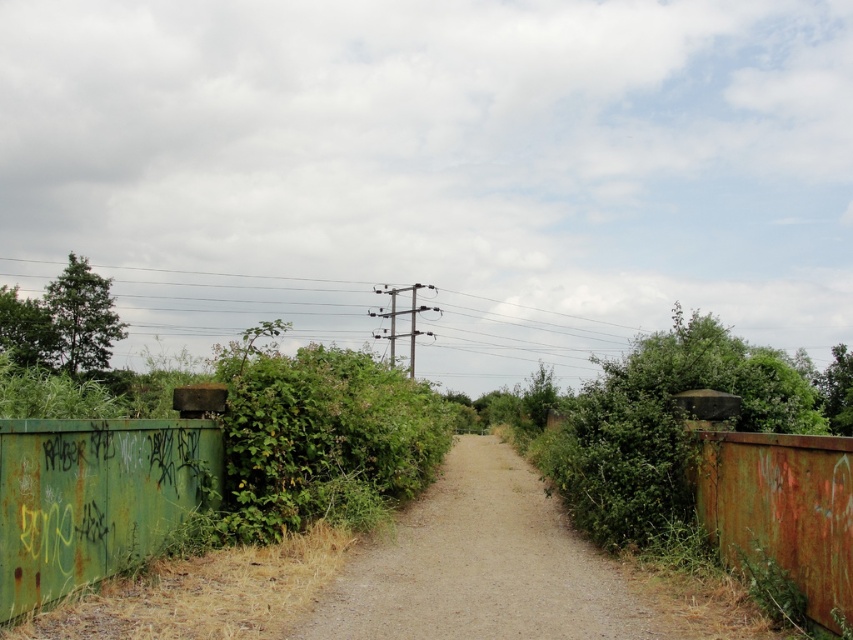
Is brown gravel path at center positioned behind rusty green metal fence at lower left?

Yes, brown gravel path at center is further from the viewer.

Is brown gravel path at center shorter than rusty green metal fence at lower left?

Indeed, brown gravel path at center has a lesser height compared to rusty green metal fence at lower left.

Does point (416, 548) lie in front of point (56, 513)?

No, it is not.

I want to click on brown gravel path at center, so click(x=480, y=564).

Is rusty green metal fence at lower left taller than rusty metal fence at right?

In fact, rusty green metal fence at lower left may be shorter than rusty metal fence at right.

Which is above, rusty green metal fence at lower left or rusty metal fence at right?

rusty green metal fence at lower left

Is point (41, 564) closer to camera compared to point (798, 490)?

Yes, point (41, 564) is closer to viewer.

At what (x,y) coordinates should I click in order to perform the action: click on rusty green metal fence at lower left. Please return your answer as a coordinate pair (x, y). This screenshot has height=640, width=853. Looking at the image, I should click on (93, 497).

Does brown gravel path at center have a greater height compared to rusty metal fence at right?

In fact, brown gravel path at center may be shorter than rusty metal fence at right.

Can you confirm if brown gravel path at center is positioned to the left of rusty metal fence at right?

Yes, brown gravel path at center is to the left of rusty metal fence at right.

Between point (367, 576) and point (811, 584), which one is positioned behind?

Point (367, 576)

The width and height of the screenshot is (853, 640). In order to click on brown gravel path at center in this screenshot , I will do `click(480, 564)`.